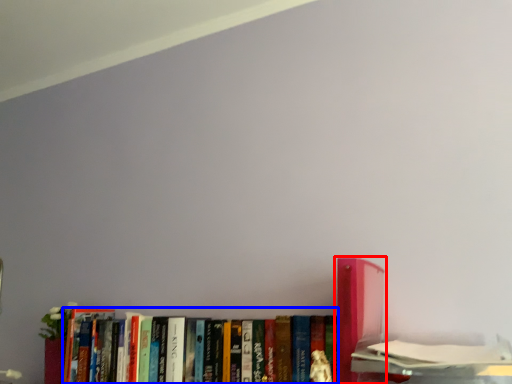
Question: Among these objects, which one is nearest to the camera, book (highlighted by a red box) or book (highlighted by a blue box)?

Choices:
 (A) book
 (B) book

Answer: (A)